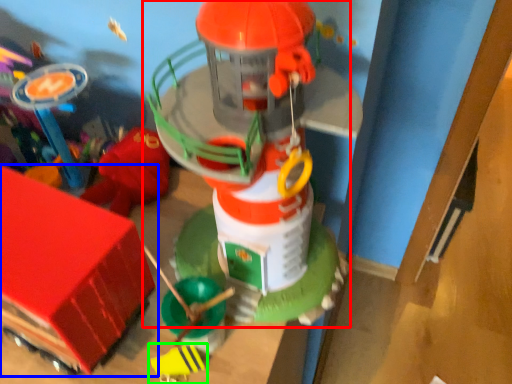
Question: Considering the real-world distances, which object is farthest from toy (highlighted by a red box)? toy (highlighted by a blue box) or toy (highlighted by a green box)?

Choices:
 (A) toy
 (B) toy

Answer: (B)